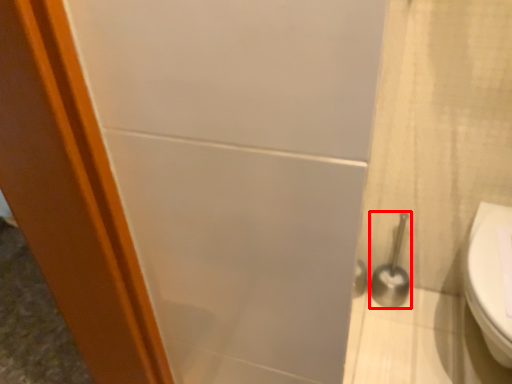
Question: From the image's perspective, considering the relative positions of shower (annotated by the red box) and toilet in the image provided, where is shower (annotated by the red box) located with respect to the staircase?

Choices:
 (A) below
 (B) above

Answer: (B)